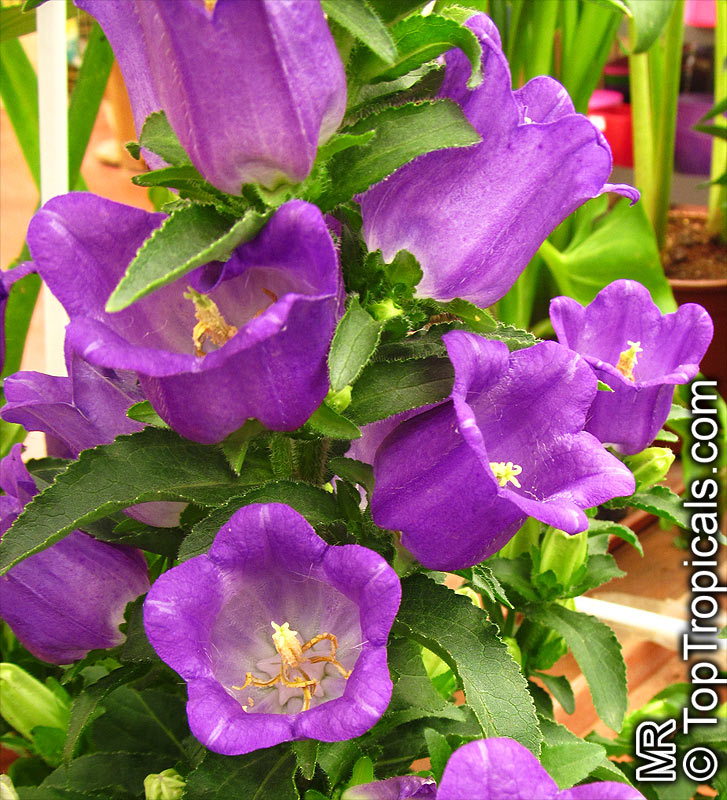
At what (x,y) coordinates should I click in order to perform the action: click on soil in flower pot. Please return your answer as a coordinate pair (x, y). This screenshot has height=800, width=727. Looking at the image, I should click on 698,270.